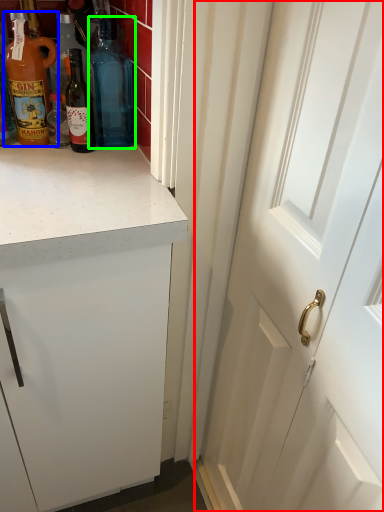
Question: Which object is the closest to the door (highlighted by a red box)? Choose among these: bottle (highlighted by a blue box) or bottle (highlighted by a green box).

Choices:
 (A) bottle
 (B) bottle

Answer: (B)